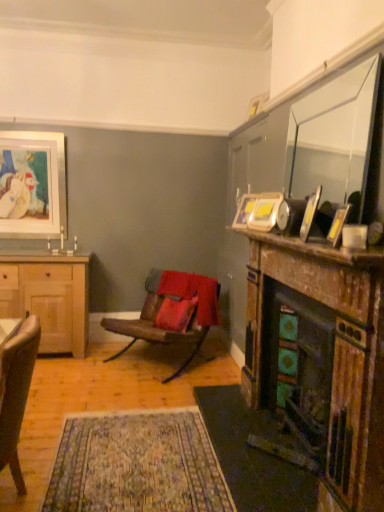
Describe the element at coordinates (33, 185) in the screenshot. I see `matte white picture frame at upper left, acting as the 1th picture frame starting from the back` at that location.

Where is `matte white picture frame at upper left, acting as the 1th picture frame starting from the back`? The height and width of the screenshot is (512, 384). matte white picture frame at upper left, acting as the 1th picture frame starting from the back is located at coordinates (33, 185).

Find the location of a particular element. matte gold picture frame at upper center, placed as the 2th picture frame when sorted from left to right is located at coordinates (244, 211).

Image resolution: width=384 pixels, height=512 pixels. Identify the location of yellow matte picture frame at upper right, which is the first picture frame from right to left. (330, 221).

Measure the distance between point (317, 208) and camera.

The distance of point (317, 208) from camera is 1.91 meters.

What do you see at coordinates (310, 213) in the screenshot?
I see `metallic gold picture frame at upper right, which is the fourth picture frame in left-to-right order` at bounding box center [310, 213].

At what (x,y) coordinates should I click in order to perform the action: click on leather at center, which ranks as the 2th chair in front-to-back order. Please return your answer as a coordinate pair (x, y). The height and width of the screenshot is (512, 384). Looking at the image, I should click on (174, 302).

Locate an element on the screen. matte white picture frame at upper left, which ranks as the fifth picture frame in front-to-back order is located at coordinates (33, 185).

The height and width of the screenshot is (512, 384). I want to click on the 5th picture frame to the left of the wooden fireplace at right, starting your count from the anchor, so click(33, 185).

Relative to matte white picture frame at upper left, marked as the 5th picture frame in a right-to-left arrangement, is wooden fireplace at right in front or behind?

Visually, wooden fireplace at right is located in front of matte white picture frame at upper left, marked as the 5th picture frame in a right-to-left arrangement.

Based on their sizes in the image, would you say wooden fireplace at right is bigger or smaller than matte white picture frame at upper left, the 1th picture frame when ordered from left to right?

In the image, wooden fireplace at right appears to be larger than matte white picture frame at upper left, the 1th picture frame when ordered from left to right.

From a real-world perspective, who is located higher, wooden fireplace at right or matte white picture frame at upper left, which ranks as the fifth picture frame in front-to-back order?

matte white picture frame at upper left, which ranks as the fifth picture frame in front-to-back order, from a real-world perspective.

Is clear glass mirror at upper right taller or shorter than leather at center, placed as the first chair when sorted from back to front?

In the image, clear glass mirror at upper right appears to be taller than leather at center, placed as the first chair when sorted from back to front.

How far apart are clear glass mirror at upper right and leather at center, which ranks as the 2th chair in front-to-back order?

clear glass mirror at upper right is 6.29 feet away from leather at center, which ranks as the 2th chair in front-to-back order.

Is clear glass mirror at upper right in front of or behind leather at center, which ranks as the 2th chair in front-to-back order, in the image?

Clearly, clear glass mirror at upper right is in front of leather at center, which ranks as the 2th chair in front-to-back order.

In the scene shown: Is clear glass mirror at upper right in contact with leather at center, which ranks as the 2th chair in front-to-back order?

clear glass mirror at upper right is not next to leather at center, which ranks as the 2th chair in front-to-back order, and they're not touching.

Consider the image. Do you think wooden fireplace at right is within metallic gold picture frame at upper right, which is the fourth picture frame in left-to-right order, or outside of it?

The correct answer is: outside.

Looking at the image, does wooden fireplace at right seem bigger or smaller compared to metallic gold picture frame at upper right, acting as the fourth picture frame starting from the back?

Clearly, wooden fireplace at right is larger in size than metallic gold picture frame at upper right, acting as the fourth picture frame starting from the back.

In the image, there is a metallic gold picture frame at upper right, acting as the fourth picture frame starting from the back. At what (x,y) coordinates should I click in order to perform the action: click on fireplace below it (from a real-world perspective). Please return your answer as a coordinate pair (x, y). The width and height of the screenshot is (384, 512). Looking at the image, I should click on (319, 362).

From the image's perspective, which object appears higher, wooden fireplace at right or metallic gold picture frame at upper right, acting as the second picture frame starting from the front?

From the image's view, metallic gold picture frame at upper right, acting as the second picture frame starting from the front, is above.

Is point (333, 152) farther from camera compared to point (249, 412)?

Yes, it is behind point (249, 412).

Locate an element on the screen. The image size is (384, 512). mirror positioned vertically above the dark brown textured rug at lower center (from a real-world perspective) is located at coordinates click(x=335, y=138).

Does clear glass mirror at upper right have a lesser width compared to dark brown textured rug at lower center?

Correct, the width of clear glass mirror at upper right is less than that of dark brown textured rug at lower center.

Consider the image. Can we say clear glass mirror at upper right lies outside dark brown textured rug at lower center?

Yes.

How far apart are dark brown textured rug at lower center and wooden fireplace at right?

They are 18.60 inches apart.

What's the angular difference between dark brown textured rug at lower center and wooden fireplace at right's facing directions?

0.001 degrees separate the facing orientations of dark brown textured rug at lower center and wooden fireplace at right.

Considering the relative sizes of dark brown textured rug at lower center and wooden fireplace at right in the image provided, is dark brown textured rug at lower center smaller than wooden fireplace at right?

Yes, dark brown textured rug at lower center is smaller than wooden fireplace at right.

Looking at this image, is the depth of dark brown textured rug at lower center greater than that of wooden fireplace at right?

Yes, it is.

Is leather at center, which ranks as the 2th chair in front-to-back order, bigger than dark brown textured rug at lower center?

Correct, leather at center, which ranks as the 2th chair in front-to-back order, is larger in size than dark brown textured rug at lower center.

Based on the photo, from a real-world perspective, which object stands above the other?

leather at center, placed as the first chair when sorted from back to front.

In the scene shown: Is leather at center, which ranks as the 2th chair in front-to-back order, to the left of dark brown textured rug at lower center from the viewer's perspective?

Yes.

From a real-world perspective, is dark brown textured rug at lower center over velvet beige armchair at lower left, which is counted as the first chair, starting from the front?

Incorrect, from a real-world perspective, dark brown textured rug at lower center is lower than velvet beige armchair at lower left, which is counted as the first chair, starting from the front.

Is dark brown textured rug at lower center directly adjacent to velvet beige armchair at lower left, which ranks as the 2th chair in back-to-front order?

They are not placed beside each other.

Does dark brown textured rug at lower center appear on the right side of velvet beige armchair at lower left, which is counted as the first chair, starting from the front?

Yes.

Between dark brown textured rug at lower center and velvet beige armchair at lower left, which ranks as the 2th chair in back-to-front order, which one has smaller width?

With smaller width is velvet beige armchair at lower left, which ranks as the 2th chair in back-to-front order.

From the image's perspective, starting from the wooden fireplace at right, which picture frame is the 5th one above? Please provide its 2D coordinates.

[(33, 185)]

Where is `mirror in front of the leather at center, placed as the first chair when sorted from back to front`? The height and width of the screenshot is (512, 384). mirror in front of the leather at center, placed as the first chair when sorted from back to front is located at coordinates (335, 138).

Looking at the image, which one is located further to clear glass mirror at upper right, yellow matte picture frame at upper right, placed as the 5th picture frame when sorted from left to right, or metallic gold picture frame at upper right, acting as the second picture frame starting from the front?

metallic gold picture frame at upper right, acting as the second picture frame starting from the front, is positioned further to the anchor clear glass mirror at upper right.

From the image, which object appears to be nearer to metallic silver picture frame at upper right, positioned as the 3th picture frame in right-to-left order, clear glass mirror at upper right or matte gold picture frame at upper center, which is counted as the fourth picture frame, starting from the right?

Among the two, matte gold picture frame at upper center, which is counted as the fourth picture frame, starting from the right, is located nearer to metallic silver picture frame at upper right, positioned as the 3th picture frame in right-to-left order.

Considering their positions, is light brown wooden cabinet at left positioned closer to wooden mantelpiece at right than wooden fireplace at right?

wooden fireplace at right.

When comparing their distances from matte white picture frame at upper left, marked as the 5th picture frame in a right-to-left arrangement, does light brown wooden cabinet at left or velvet beige armchair at lower left, which ranks as the 2th chair in back-to-front order, seem further?

velvet beige armchair at lower left, which ranks as the 2th chair in back-to-front order, lies further to matte white picture frame at upper left, marked as the 5th picture frame in a right-to-left arrangement, than the other object.

Looking at this image, which object lies nearer to the anchor point matte gold picture frame at upper center, placed as the 2th picture frame when sorted from left to right, wooden mantelpiece at right or clear glass mirror at upper right?

wooden mantelpiece at right is closer to matte gold picture frame at upper center, placed as the 2th picture frame when sorted from left to right.

Considering their positions, is clear glass mirror at upper right positioned closer to dark brown textured rug at lower center than yellow matte picture frame at upper right, placed as the 5th picture frame when sorted from left to right?

yellow matte picture frame at upper right, placed as the 5th picture frame when sorted from left to right, is closer to dark brown textured rug at lower center.

Which object lies further to the anchor point metallic silver picture frame at upper right, the 3th picture frame viewed from the front, velvet beige armchair at lower left, which ranks as the 2th chair in back-to-front order, or matte white picture frame at upper left, marked as the 5th picture frame in a right-to-left arrangement?

matte white picture frame at upper left, marked as the 5th picture frame in a right-to-left arrangement, is further to metallic silver picture frame at upper right, the 3th picture frame viewed from the front.

Looking at the image, which one is located further to metallic gold picture frame at upper right, acting as the fourth picture frame starting from the back, matte gray corded phone at upper right or leather at center, placed as the first chair when sorted from back to front?

leather at center, placed as the first chair when sorted from back to front, is positioned further to the anchor metallic gold picture frame at upper right, acting as the fourth picture frame starting from the back.

Where is `fireplace between wooden mantelpiece at right and matte white picture frame at upper left, which ranks as the fifth picture frame in front-to-back order, from front to back`? fireplace between wooden mantelpiece at right and matte white picture frame at upper left, which ranks as the fifth picture frame in front-to-back order, from front to back is located at coordinates (319, 362).

Where is `corded phone positioned between wooden mantelpiece at right and metallic silver picture frame at upper right, placed as the 3th picture frame when sorted from left to right, from near to far`? This screenshot has height=512, width=384. corded phone positioned between wooden mantelpiece at right and metallic silver picture frame at upper right, placed as the 3th picture frame when sorted from left to right, from near to far is located at coordinates (290, 216).

Where is `mirror between wooden fireplace at right and matte gold picture frame at upper center, the fourth picture frame positioned from the front, from front to back`? mirror between wooden fireplace at right and matte gold picture frame at upper center, the fourth picture frame positioned from the front, from front to back is located at coordinates (335, 138).

You are a GUI agent. You are given a task and a screenshot of the screen. Output one action in this format:
    pyautogui.click(x=<x>, y=<y>)
    Task: Click on the mirror between yellow matte picture frame at upper right, placed as the 5th picture frame when sorted from left to right, and matte gray corded phone at upper right, along the z-axis
    
    Given the screenshot: What is the action you would take?
    pyautogui.click(x=335, y=138)